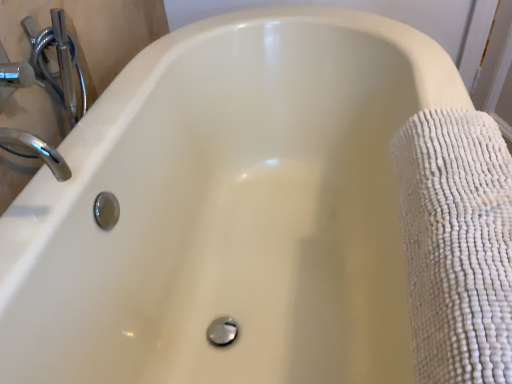
The height and width of the screenshot is (384, 512). Identify the location of white textured towel at right. (457, 244).

Describe the element at coordinates (457, 244) in the screenshot. I see `white textured towel at right` at that location.

The image size is (512, 384). What are the coordinates of `chrome/metallic faucet at upper left` in the screenshot? It's located at (57, 59).

The image size is (512, 384). What do you see at coordinates (57, 59) in the screenshot?
I see `chrome/metallic faucet at upper left` at bounding box center [57, 59].

This screenshot has width=512, height=384. In order to click on white textured towel at right in this screenshot , I will do `click(457, 244)`.

Does chrome/metallic faucet at upper left appear on the right side of white textured towel at right?

No.

Which object is further away from the camera, chrome/metallic faucet at upper left or white textured towel at right?

chrome/metallic faucet at upper left is further away from the camera.

Is point (57, 72) farther from viewer compared to point (408, 263)?

Yes, point (57, 72) is behind point (408, 263).

From the image's perspective, is chrome/metallic faucet at upper left beneath white textured towel at right?

No, from the image's perspective, chrome/metallic faucet at upper left is not beneath white textured towel at right.

From a real-world perspective, which is physically below, chrome/metallic faucet at upper left or white textured towel at right?

From a 3D spatial view, white textured towel at right is below.

Considering the sizes of objects chrome/metallic faucet at upper left and white textured towel at right in the image provided, who is thinner, chrome/metallic faucet at upper left or white textured towel at right?

With smaller width is chrome/metallic faucet at upper left.

In terms of height, does chrome/metallic faucet at upper left look taller or shorter compared to white textured towel at right?

chrome/metallic faucet at upper left is shorter than white textured towel at right.

Is chrome/metallic faucet at upper left bigger than white textured towel at right?

No, chrome/metallic faucet at upper left is not bigger than white textured towel at right.

From the picture: Is white textured towel at right a part of chrome/metallic faucet at upper left?

No, white textured towel at right is located outside of chrome/metallic faucet at upper left.

Is chrome/metallic faucet at upper left next to white textured towel at right?

They are not placed beside each other.

Does chrome/metallic faucet at upper left turn towards white textured towel at right?

Yes, chrome/metallic faucet at upper left is turned towards white textured towel at right.

The image size is (512, 384). I want to click on bath towel below the chrome/metallic faucet at upper left (from the image's perspective), so click(457, 244).

Can you confirm if white textured towel at right is positioned to the right of chrome/metallic faucet at upper left?

Indeed, white textured towel at right is positioned on the right side of chrome/metallic faucet at upper left.

Is white textured towel at right in front of or behind chrome/metallic faucet at upper left in the image?

Clearly, white textured towel at right is in front of chrome/metallic faucet at upper left.

Which point is more distant from viewer, (503, 247) or (60, 41)?

The point (60, 41) is farther.

From the image's perspective, which object appears higher, white textured towel at right or chrome/metallic faucet at upper left?

chrome/metallic faucet at upper left is shown above in the image.

From a real-world perspective, which is physically above, white textured towel at right or chrome/metallic faucet at upper left?

From a 3D spatial view, chrome/metallic faucet at upper left is above.

Can you confirm if white textured towel at right is wider than chrome/metallic faucet at upper left?

Correct, the width of white textured towel at right exceeds that of chrome/metallic faucet at upper left.

Is white textured towel at right shorter than chrome/metallic faucet at upper left?

Incorrect, the height of white textured towel at right does not fall short of that of chrome/metallic faucet at upper left.

Looking at this image, considering the sizes of objects white textured towel at right and chrome/metallic faucet at upper left in the image provided, who is smaller, white textured towel at right or chrome/metallic faucet at upper left?

chrome/metallic faucet at upper left.

Is white textured towel at right inside or outside of chrome/metallic faucet at upper left?

white textured towel at right is outside chrome/metallic faucet at upper left.

Are white textured towel at right and chrome/metallic faucet at upper left located far from each other?

That's not correct — white textured towel at right is a little close to chrome/metallic faucet at upper left.

Is white textured towel at right oriented towards chrome/metallic faucet at upper left?

No, white textured towel at right is not oriented towards chrome/metallic faucet at upper left.

Can you tell me how much white textured towel at right and chrome/metallic faucet at upper left differ in facing direction?

There is a 0.0688-degree angle between the facing directions of white textured towel at right and chrome/metallic faucet at upper left.

The width and height of the screenshot is (512, 384). Find the location of `bath towel that appears below the chrome/metallic faucet at upper left (from the image's perspective)`. bath towel that appears below the chrome/metallic faucet at upper left (from the image's perspective) is located at coordinates (457, 244).

The height and width of the screenshot is (384, 512). In order to click on plumbing fixture on the left of the white textured towel at right in this screenshot , I will do `click(57, 59)`.

At what (x,y) coordinates should I click in order to perform the action: click on plumbing fixture above the white textured towel at right (from the image's perspective). Please return your answer as a coordinate pair (x, y). Looking at the image, I should click on (57, 59).